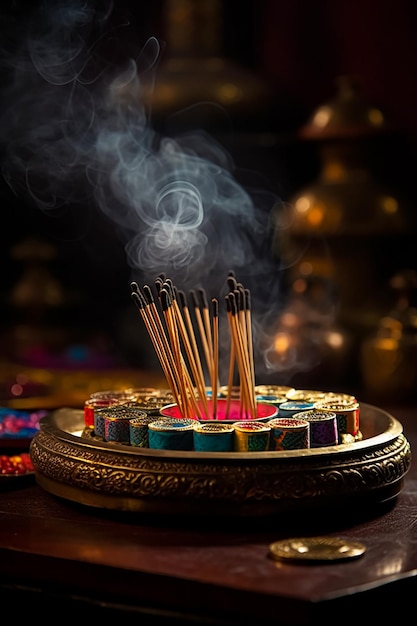
Identify the location of blue/pink object on the table. This screenshot has height=626, width=417. (16, 418).